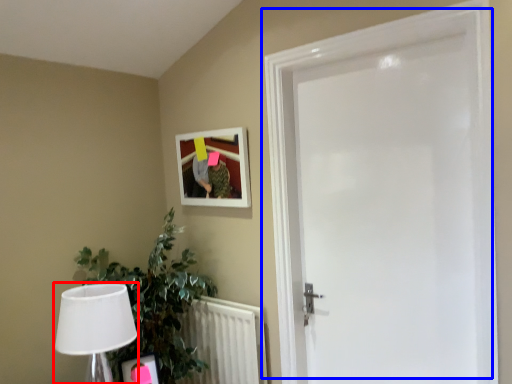
Question: Which object is closer to the camera taking this photo, table lamp (highlighted by a red box) or door (highlighted by a blue box)?

Choices:
 (A) table lamp
 (B) door

Answer: (B)